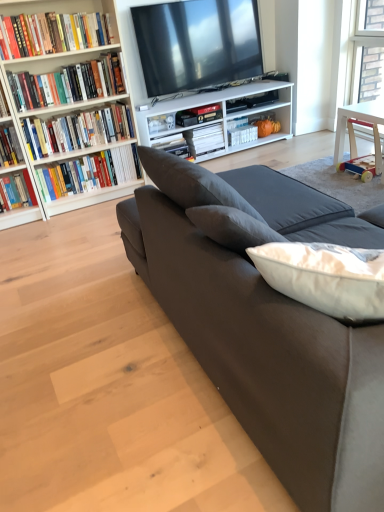
Identify the location of vacant space in front of white wood bookshelf at left. Image resolution: width=384 pixels, height=512 pixels. (54, 232).